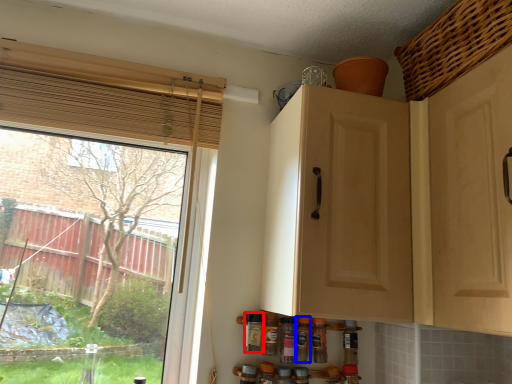
Question: Which point is further to the camera, bottle (highlighted by a red box) or bottle (highlighted by a blue box)?

Choices:
 (A) bottle
 (B) bottle

Answer: (B)